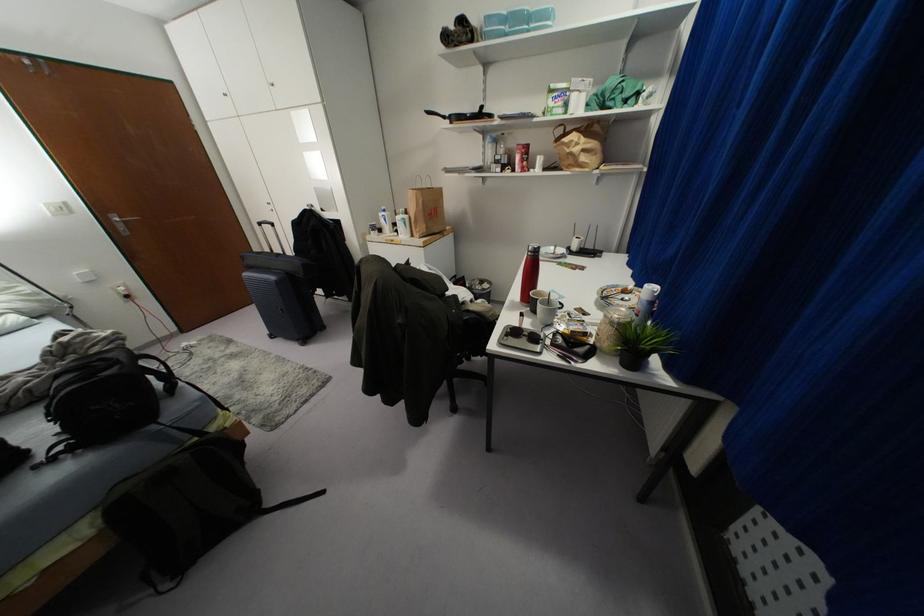
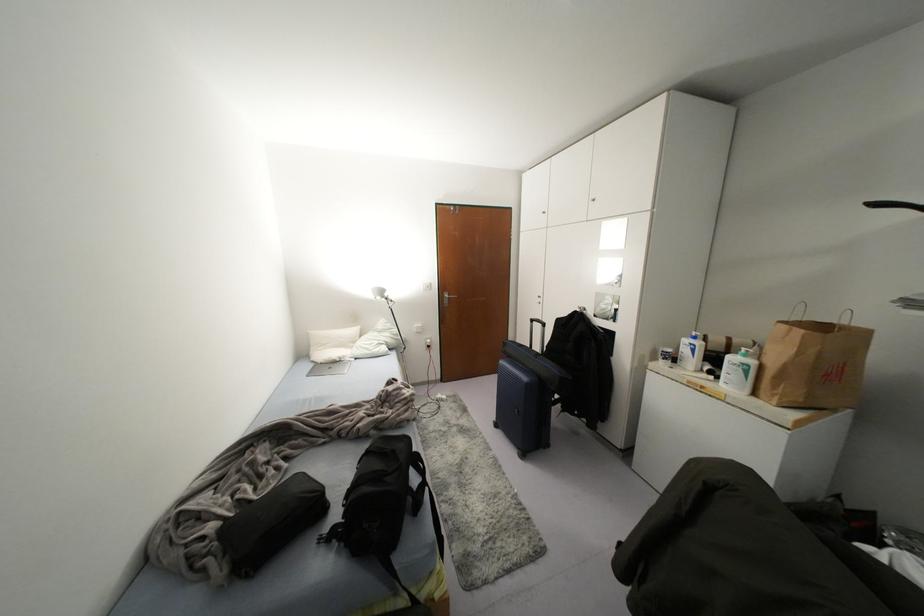
The point at (101, 359) is marked in the first image. Where is the corresponding point in the second image?

(393, 451)